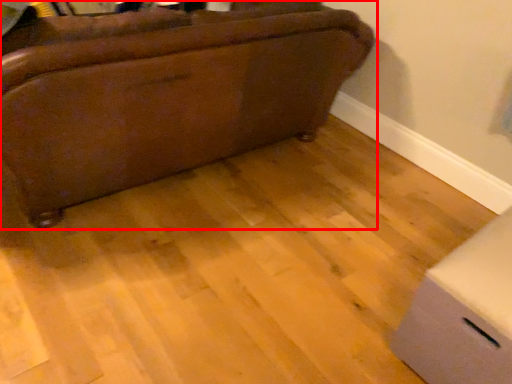
Question: From the image's perspective, considering the relative positions of furniture (annotated by the red box) and cardboard box in the image provided, where is furniture (annotated by the red box) located with respect to the staircase?

Choices:
 (A) below
 (B) above

Answer: (B)